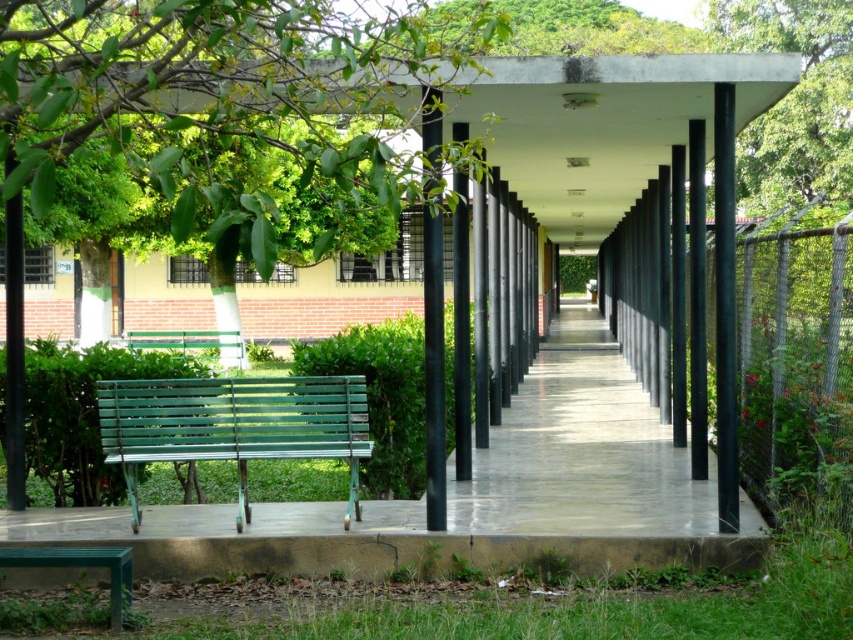
Question: Can you confirm if concrete at center is smaller than green painted wood bench at center?

Choices:
 (A) no
 (B) yes

Answer: (A)

Question: Which object is positioned closest to the green painted wood bench at center?

Choices:
 (A) green leafy tree at upper left
 (B) concrete at center
 (C) chain-link fence at right

Answer: (B)

Question: Does concrete at center appear on the right side of chain-link fence at right?

Choices:
 (A) yes
 (B) no

Answer: (B)

Question: Which of the following is the closest to the observer?

Choices:
 (A) (743, 348)
 (B) (33, 60)
 (C) (296, 426)

Answer: (B)

Question: Can you confirm if concrete at center is thinner than green painted wood bench at center?

Choices:
 (A) no
 (B) yes

Answer: (A)

Question: Based on their relative distances, which object is farther from the green painted wood bench at center?

Choices:
 (A) chain-link fence at right
 (B) concrete at center

Answer: (A)